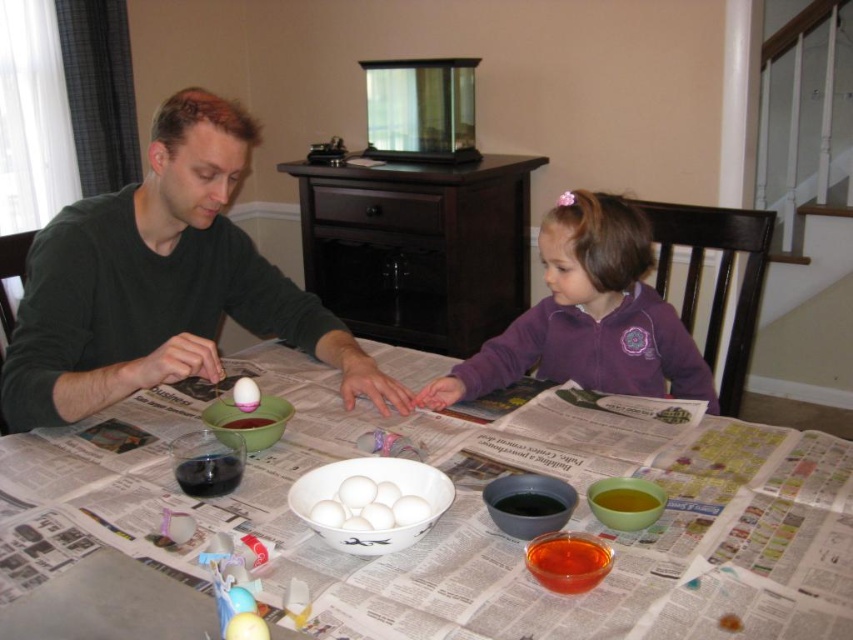
You are standing at the edge of the table in the dining room where the Easter egg dyeing activity is happening. You see the white glossy eggs at center and the white glossy egg at center. Which one is closer to you?

The white glossy eggs at center is closer to you because it is further to the viewer than the white glossy egg at center.

Where are the white glossy eggs at center located in the image?

The white glossy eggs at center are located at point coordinates of (368, 506).

You are a child helping to dye eggs. You notice the matte black egg at left and the white glossy egg at center. Which egg is positioned higher on the table?

The matte black egg at left is positioned higher on the table than the white glossy egg at center.